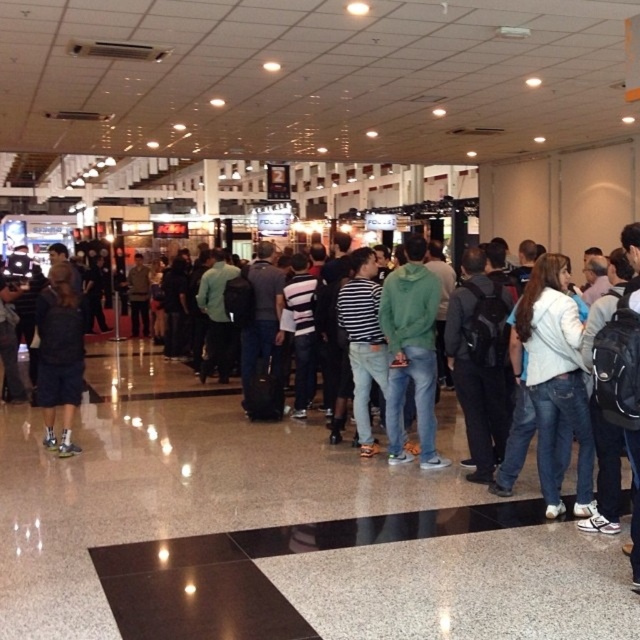
You are standing in the convention center and see a white cotton jacket at right and a dark gray shorts at left. Which one is positioned more to the right side of the scene?

The white cotton jacket at right is positioned more to the right side of the scene than the dark gray shorts at left.

You are standing at the entrance of the convention center and notice a white cotton jacket at right. If you want to reach it quickly, in which general direction should you move?

The white cotton jacket at right is located at point 0.592 on the x and 0.869 on the y, so you should move towards the upper right direction to reach it quickly.